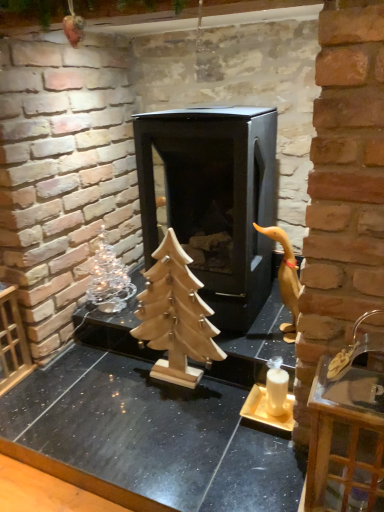
Identify the location of vacant area in front of white matte candle holder at lower right. (264, 459).